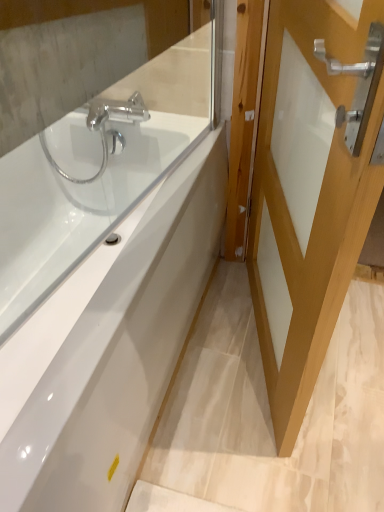
I want to click on clear glass mirror at upper left, acting as the first mirror starting from the back, so click(x=73, y=54).

Locate an element on the screen. white glossy door at right is located at coordinates (311, 188).

Is clear glass mirror at upper left, acting as the first mirror starting from the back, far from clear glass mirror at upper left, arranged as the first mirror when viewed from the front?

No, there isn't a large distance between clear glass mirror at upper left, acting as the first mirror starting from the back, and clear glass mirror at upper left, arranged as the first mirror when viewed from the front.

In the scene shown: Is clear glass mirror at upper left, acting as the first mirror starting from the back, behind clear glass mirror at upper left, arranged as the first mirror when viewed from the front?

Yes, clear glass mirror at upper left, acting as the first mirror starting from the back, is further from the viewer.

Does clear glass mirror at upper left, the 2th mirror positioned from the front, have a greater height compared to clear glass mirror at upper left, which is the 2th mirror in back-to-front order?

Yes.

Which of these two, white glossy door at right or clear glass mirror at upper left, arranged as the first mirror when viewed from the front, stands shorter?

clear glass mirror at upper left, arranged as the first mirror when viewed from the front.

How many degrees apart are the facing directions of white glossy door at right and clear glass mirror at upper left, which is the 2th mirror in back-to-front order?

There is a 27.4-degree angle between the facing directions of white glossy door at right and clear glass mirror at upper left, which is the 2th mirror in back-to-front order.

Is the surface of white glossy door at right in direct contact with clear glass mirror at upper left, arranged as the first mirror when viewed from the front?

No.

Between point (279, 274) and point (22, 168), which one is positioned behind?

The point (22, 168) is farther.

Which is farther, (58, 49) or (331, 19)?

The point (58, 49) is more distant.

Considering the relative sizes of clear glass mirror at upper left, acting as the first mirror starting from the back, and white glossy door at right in the image provided, is clear glass mirror at upper left, acting as the first mirror starting from the back, thinner than white glossy door at right?

No, clear glass mirror at upper left, acting as the first mirror starting from the back, is not thinner than white glossy door at right.

Consider the image. Is clear glass mirror at upper left, acting as the first mirror starting from the back, bigger than white glossy door at right?

No.

Considering the sizes of objects white glossy bathtub at center and clear glass mirror at upper left, arranged as the first mirror when viewed from the front, in the image provided, who is taller, white glossy bathtub at center or clear glass mirror at upper left, arranged as the first mirror when viewed from the front,?

white glossy bathtub at center is taller.

Who is smaller, white glossy bathtub at center or clear glass mirror at upper left, arranged as the first mirror when viewed from the front?

Smaller between the two is clear glass mirror at upper left, arranged as the first mirror when viewed from the front.

Can you see white glossy bathtub at center touching clear glass mirror at upper left, arranged as the first mirror when viewed from the front?

white glossy bathtub at center is not next to clear glass mirror at upper left, arranged as the first mirror when viewed from the front, and they're not touching.

In order to click on bathtub that is under the clear glass mirror at upper left, arranged as the first mirror when viewed from the front (from a real-world perspective) in this screenshot , I will do `click(120, 352)`.

Is clear glass mirror at upper left, which is the 2th mirror in back-to-front order, to the left or to the right of white glossy door at right in the image?

From the image, it's evident that clear glass mirror at upper left, which is the 2th mirror in back-to-front order, is to the left of white glossy door at right.

From a real-world perspective, is clear glass mirror at upper left, arranged as the first mirror when viewed from the front, positioned over white glossy door at right based on gravity?

Yes, from a real-world perspective, clear glass mirror at upper left, arranged as the first mirror when viewed from the front, is on top of white glossy door at right.

Is clear glass mirror at upper left, arranged as the first mirror when viewed from the front, far from white glossy door at right?

clear glass mirror at upper left, arranged as the first mirror when viewed from the front, is near white glossy door at right, not far away.

Could you tell me if clear glass mirror at upper left, which is the 2th mirror in back-to-front order, is turned towards white glossy door at right?

Yes, clear glass mirror at upper left, which is the 2th mirror in back-to-front order, faces towards white glossy door at right.

From a real-world perspective, which object stands above the other?

white glossy door at right is physically above.

Considering their positions, is white glossy door at right located in front of or behind white glossy bathtub at center?

white glossy door at right is in front of white glossy bathtub at center.

Is white glossy door at right facing towards white glossy bathtub at center?

Yes, white glossy door at right is aimed at white glossy bathtub at center.

From the image's perspective, is white glossy door at right located beneath white glossy bathtub at center?

No, from the image's perspective, white glossy door at right is not beneath white glossy bathtub at center.

From a real-world perspective, is clear glass mirror at upper left, the 2th mirror positioned from the front, on white glossy bathtub at center?

Indeed, from a real-world perspective, clear glass mirror at upper left, the 2th mirror positioned from the front, stands above white glossy bathtub at center.

In the image, is clear glass mirror at upper left, acting as the first mirror starting from the back, positioned in front of or behind white glossy bathtub at center?

In the image, clear glass mirror at upper left, acting as the first mirror starting from the back, appears behind white glossy bathtub at center.

In the image, is clear glass mirror at upper left, acting as the first mirror starting from the back, on the left side or the right side of white glossy bathtub at center?

Based on their positions, clear glass mirror at upper left, acting as the first mirror starting from the back, is located to the right of white glossy bathtub at center.

Where is `mirror below the clear glass mirror at upper left, arranged as the first mirror when viewed from the front (from a real-world perspective)`? mirror below the clear glass mirror at upper left, arranged as the first mirror when viewed from the front (from a real-world perspective) is located at coordinates (73, 54).

Locate an element on the screen. the 2nd mirror directly above the white glossy door at right (from a real-world perspective) is located at coordinates (101, 165).

From the image, which object appears to be nearer to white glossy bathtub at center, clear glass mirror at upper left, arranged as the first mirror when viewed from the front, or clear glass mirror at upper left, the 2th mirror positioned from the front?

clear glass mirror at upper left, arranged as the first mirror when viewed from the front, is positioned closer to the anchor white glossy bathtub at center.

Based on their spatial positions, is clear glass mirror at upper left, which is the 2th mirror in back-to-front order, or white glossy door at right further from white glossy bathtub at center?

Among the two, white glossy door at right is located further to white glossy bathtub at center.

Considering their positions, is clear glass mirror at upper left, the 2th mirror positioned from the front, positioned closer to clear glass mirror at upper left, which is the 2th mirror in back-to-front order, than white glossy door at right?

clear glass mirror at upper left, the 2th mirror positioned from the front, is positioned closer to the anchor clear glass mirror at upper left, which is the 2th mirror in back-to-front order.

Looking at the image, which one is located closer to white glossy door at right, clear glass mirror at upper left, which is the 2th mirror in back-to-front order, or clear glass mirror at upper left, the 2th mirror positioned from the front?

Based on the image, clear glass mirror at upper left, which is the 2th mirror in back-to-front order, appears to be nearer to white glossy door at right.

When comparing their distances from white glossy door at right, does clear glass mirror at upper left, arranged as the first mirror when viewed from the front, or white glossy bathtub at center seem further?

The object further to white glossy door at right is clear glass mirror at upper left, arranged as the first mirror when viewed from the front.

Consider the image. From the image, which object appears to be nearer to clear glass mirror at upper left, acting as the first mirror starting from the back, white glossy door at right or clear glass mirror at upper left, arranged as the first mirror when viewed from the front?

The object closer to clear glass mirror at upper left, acting as the first mirror starting from the back, is clear glass mirror at upper left, arranged as the first mirror when viewed from the front.

Estimate the real-world distances between objects in this image. Which object is further from white glossy door at right, white glossy bathtub at center or clear glass mirror at upper left, arranged as the first mirror when viewed from the front?

clear glass mirror at upper left, arranged as the first mirror when viewed from the front, is positioned further to the anchor white glossy door at right.

When comparing their distances from clear glass mirror at upper left, which is the 2th mirror in back-to-front order, does white glossy door at right or white glossy bathtub at center seem closer?

white glossy bathtub at center.

Locate an element on the screen. This screenshot has width=384, height=512. door positioned between clear glass mirror at upper left, arranged as the first mirror when viewed from the front, and clear glass mirror at upper left, the 2th mirror positioned from the front, from near to far is located at coordinates (311, 188).

I want to click on bathtub between clear glass mirror at upper left, which is the 2th mirror in back-to-front order, and clear glass mirror at upper left, the 2th mirror positioned from the front, from front to back, so click(120, 352).